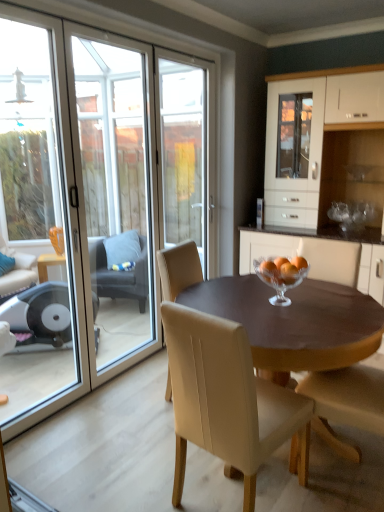
This screenshot has height=512, width=384. I want to click on vacant space situated on the left part of clear glass bowl at center, so click(x=243, y=298).